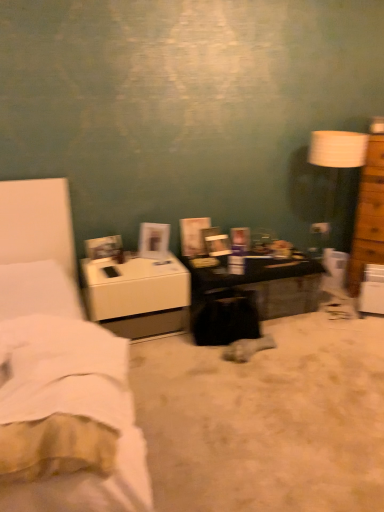
Question: Should I look upward or downward to see dark brown wooden desk at center?

Choices:
 (A) up
 (B) down

Answer: (B)

Question: Does black fabric swivel chair at center have a lesser width compared to white soft fabric bedsheet at lower left?

Choices:
 (A) yes
 (B) no

Answer: (A)

Question: Would you say black fabric swivel chair at center is a long distance from white soft fabric bedsheet at lower left?

Choices:
 (A) yes
 (B) no

Answer: (A)

Question: Is black fabric swivel chair at center facing towards white soft fabric bedsheet at lower left?

Choices:
 (A) no
 (B) yes

Answer: (B)

Question: Can you confirm if black fabric swivel chair at center is wider than white soft fabric bedsheet at lower left?

Choices:
 (A) yes
 (B) no

Answer: (B)

Question: From the image's perspective, is black fabric swivel chair at center beneath white soft fabric bedsheet at lower left?

Choices:
 (A) yes
 (B) no

Answer: (B)

Question: Is black fabric swivel chair at center to the right of white soft fabric bedsheet at lower left from the viewer's perspective?

Choices:
 (A) yes
 (B) no

Answer: (A)

Question: Is brown wooden chest of drawers at right in front of white fabric bed at left?

Choices:
 (A) yes
 (B) no

Answer: (B)

Question: From the image's perspective, is brown wooden chest of drawers at right over white fabric bed at left?

Choices:
 (A) yes
 (B) no

Answer: (A)

Question: Is brown wooden chest of drawers at right aimed at white fabric bed at left?

Choices:
 (A) yes
 (B) no

Answer: (B)

Question: Does brown wooden chest of drawers at right have a larger size compared to white fabric bed at left?

Choices:
 (A) yes
 (B) no

Answer: (B)

Question: From a real-world perspective, does brown wooden chest of drawers at right stand above white fabric bed at left?

Choices:
 (A) yes
 (B) no

Answer: (A)

Question: Can you confirm if brown wooden chest of drawers at right is wider than white fabric bed at left?

Choices:
 (A) no
 (B) yes

Answer: (A)

Question: Is dark brown wooden desk at center to the left of white soft fabric bedsheet at lower left from the viewer's perspective?

Choices:
 (A) no
 (B) yes

Answer: (A)